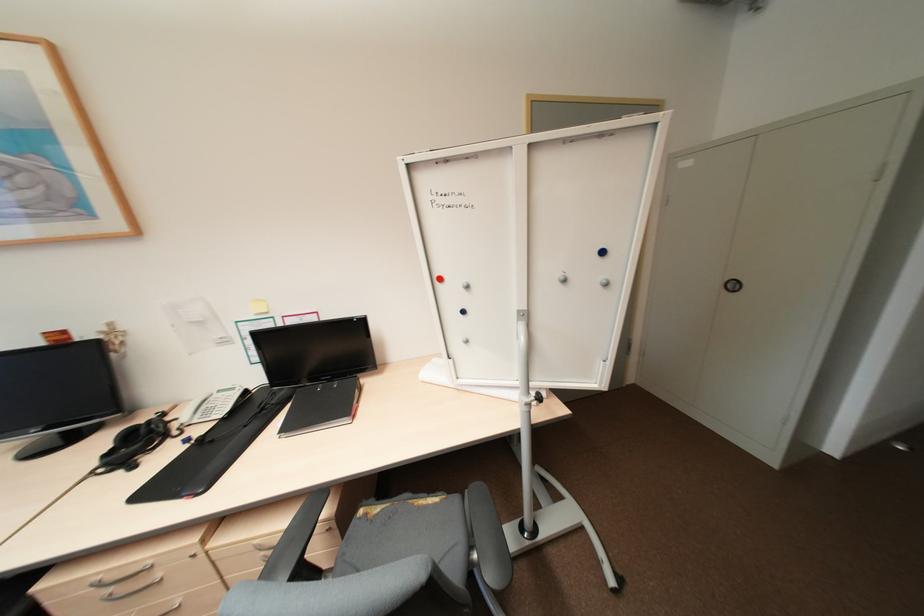
This screenshot has height=616, width=924. Describe the element at coordinates (541, 405) in the screenshot. I see `the stand adjustment knob` at that location.